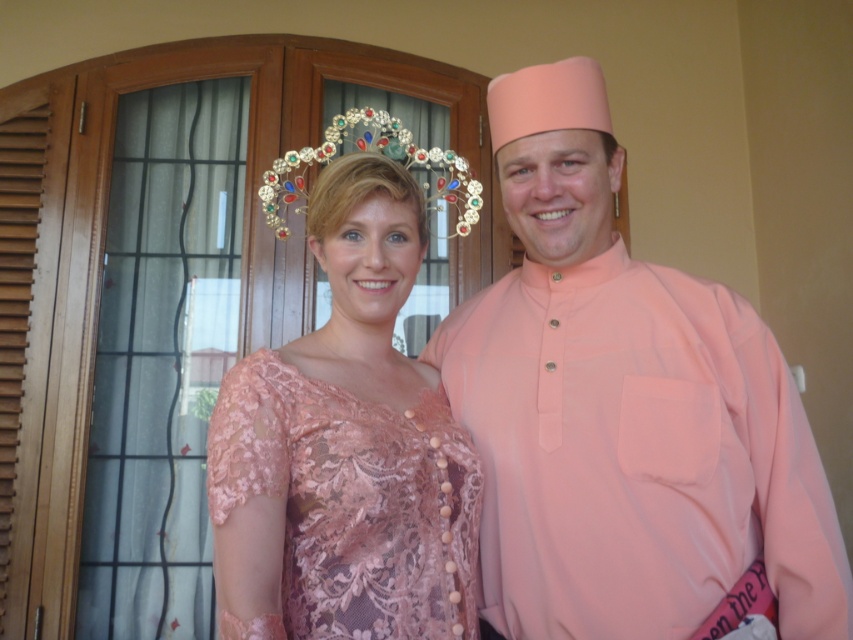
Between matte peach shirt at center and lace fabric dress at center, which one is positioned lower?

lace fabric dress at center

From the picture: Does matte peach shirt at center lie behind lace fabric dress at center?

That is True.

What do you see at coordinates (624, 408) in the screenshot?
I see `matte peach shirt at center` at bounding box center [624, 408].

The width and height of the screenshot is (853, 640). Identify the location of matte peach shirt at center. (624, 408).

Does lace fabric dress at center have a smaller size compared to multicolored jeweled tiara at upper center?

Yes, lace fabric dress at center is smaller than multicolored jeweled tiara at upper center.

Which is in front, point (238, 442) or point (277, 198)?

Point (238, 442) is more forward.

I want to click on lace fabric dress at center, so click(349, 506).

Can you confirm if matte peach shirt at center is smaller than multicolored jeweled tiara at upper center?

Correct, matte peach shirt at center occupies less space than multicolored jeweled tiara at upper center.

Is matte peach shirt at center above multicolored jeweled tiara at upper center?

No.

Where is `matte peach shirt at center`? The width and height of the screenshot is (853, 640). matte peach shirt at center is located at coordinates (624, 408).

The image size is (853, 640). Find the location of `matte peach shirt at center`. matte peach shirt at center is located at coordinates [624, 408].